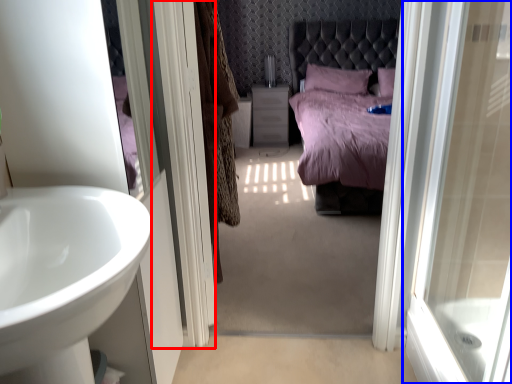
Question: Among these objects, which one is nearest to the camera, screen door (highlighted by a red box) or door (highlighted by a blue box)?

Choices:
 (A) screen door
 (B) door

Answer: (B)